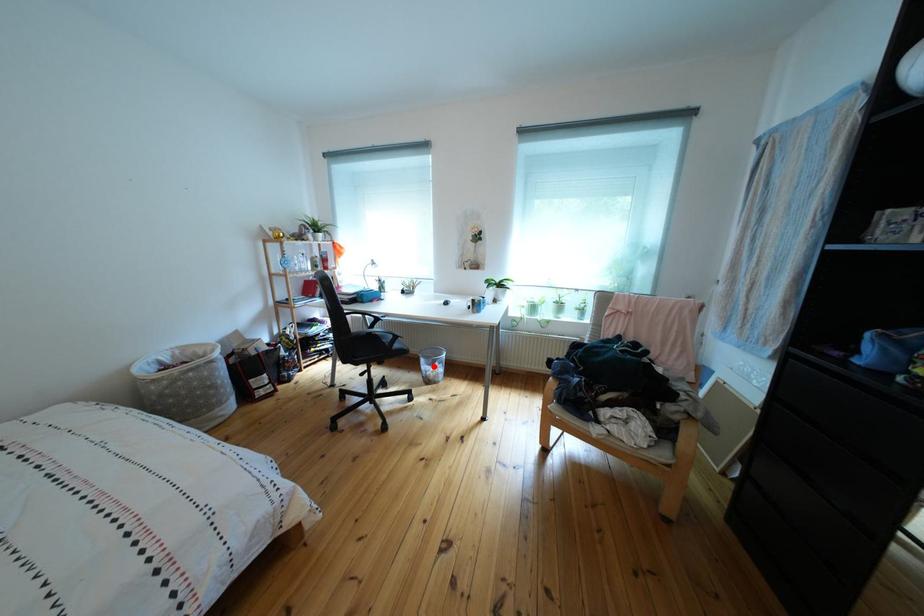
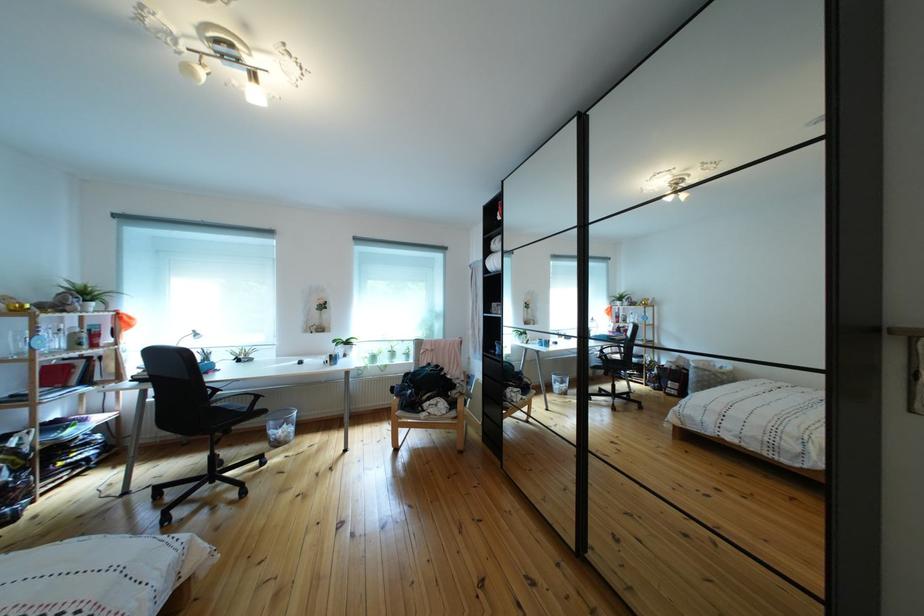
Locate, in the second image, the point that corresponds to the highlighted location in the first image.

(283, 430)